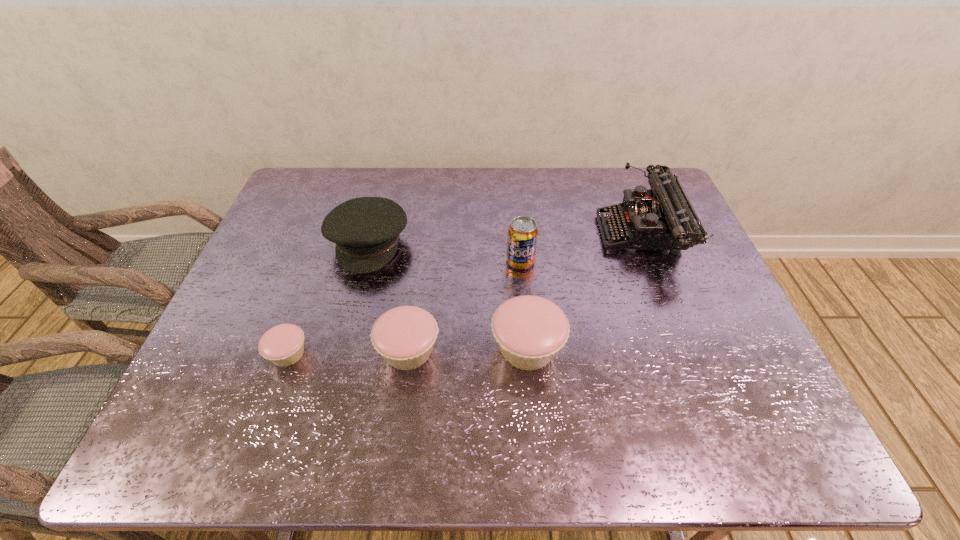
This screenshot has width=960, height=540. In order to click on blank area located on the right of the rightmost cupcake in this screenshot , I will do `click(586, 348)`.

Where is `vacant point located on the front-facing side of the beret`? The image size is (960, 540). vacant point located on the front-facing side of the beret is located at coordinates (357, 289).

Locate an element on the screen. Image resolution: width=960 pixels, height=540 pixels. free space located on the keyboard of the rightmost object is located at coordinates (580, 235).

Identify the location of vacant space located on the keyboard of the rightmost object. The image size is (960, 540). (560, 235).

The image size is (960, 540). Identify the location of vacant space located on the keyboard of the rightmost object. (480, 235).

Find the location of a particular element. The width and height of the screenshot is (960, 540). free spot located 0.380m on the back of the soda can is located at coordinates (513, 178).

Where is `object that is at the far edge`? Image resolution: width=960 pixels, height=540 pixels. object that is at the far edge is located at coordinates (662, 218).

Find the location of `object that is at the left edge`. object that is at the left edge is located at coordinates (283, 345).

Locate an element on the screen. This screenshot has width=960, height=540. object at the right edge is located at coordinates (662, 218).

Identify the location of object at the near left corner. Image resolution: width=960 pixels, height=540 pixels. (283, 345).